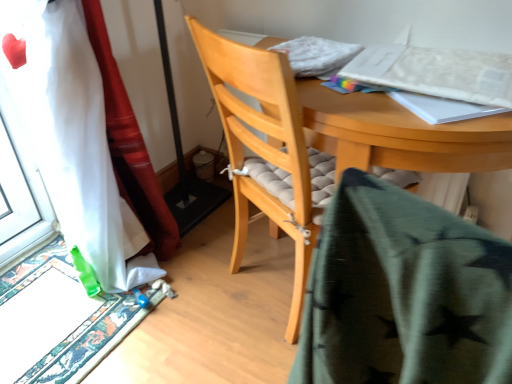
Image resolution: width=512 pixels, height=384 pixels. Identify the location of blank space above carpeted doormat at lower left (from a real-world perspective). coord(40,302).